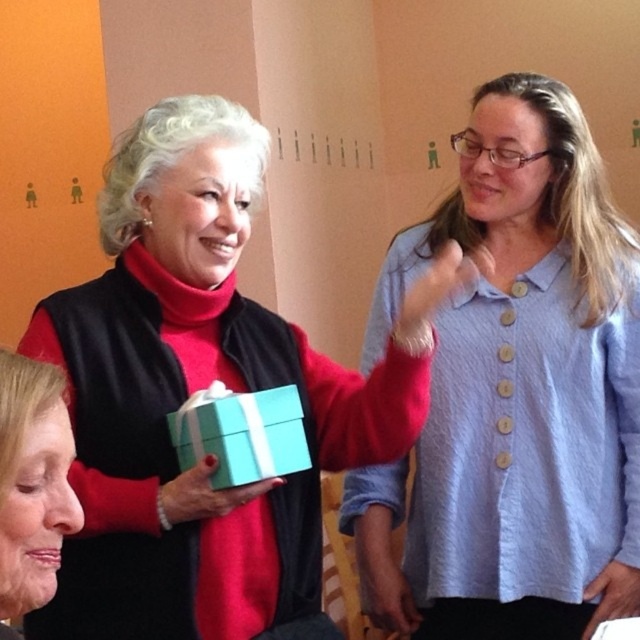
Does blue textured shirt at upper right have a lesser width compared to smooth beige face at lower left?

No.

Between point (461, 468) and point (3, 579), which one is positioned behind?

Positioned behind is point (461, 468).

At what (x,y) coordinates should I click in order to perform the action: click on blue textured shirt at upper right. Please return your answer as a coordinate pair (x, y). Image resolution: width=640 pixels, height=640 pixels. Looking at the image, I should click on (515, 394).

Is point (49, 445) positioned behind point (248, 397)?

That is False.

Can you confirm if smooth beige face at lower left is shorter than tiffany blue paper at center?

Incorrect, smooth beige face at lower left's height does not fall short of tiffany blue paper at center's.

Does point (65, 440) come behind point (237, 417)?

No, (65, 440) is closer to viewer.

At what (x,y) coordinates should I click in order to perform the action: click on smooth beige face at lower left. Please return your answer as a coordinate pair (x, y). Looking at the image, I should click on (33, 484).

From the picture: Is matte blue box at center to the left of tiffany blue paper at center from the viewer's perspective?

Yes, matte blue box at center is to the left of tiffany blue paper at center.

Is matte blue box at center above tiffany blue paper at center?

Indeed, matte blue box at center is positioned over tiffany blue paper at center.

Is point (84, 422) farther from camera compared to point (168, 419)?

That is False.

The height and width of the screenshot is (640, 640). Find the location of `matte blue box at center`. matte blue box at center is located at coordinates (202, 388).